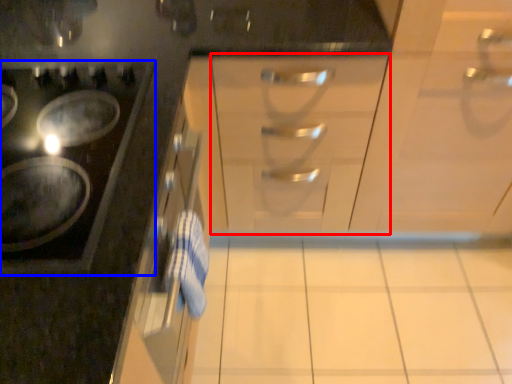
Question: Which object is closer to the camera taking this photo, drawer (highlighted by a red box) or gas stove (highlighted by a blue box)?

Choices:
 (A) drawer
 (B) gas stove

Answer: (B)